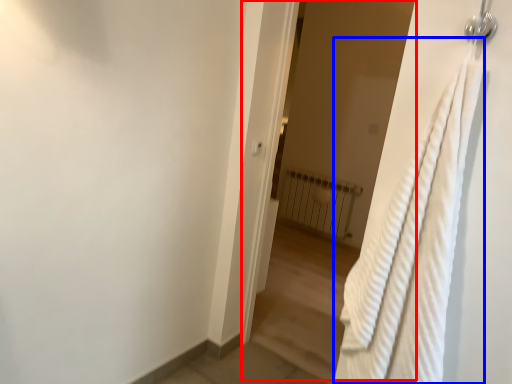
Question: Which object appears farthest to the camera in this image, screen door (highlighted by a red box) or bath towel (highlighted by a blue box)?

Choices:
 (A) screen door
 (B) bath towel

Answer: (A)